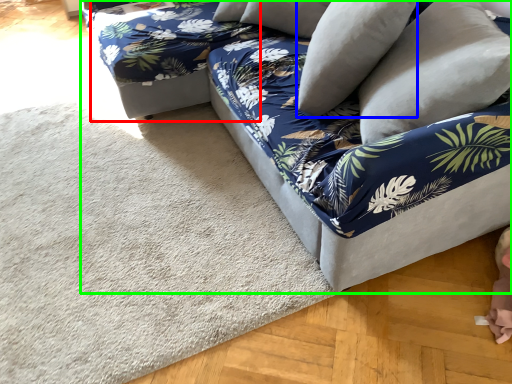
Question: Which object is positioned farthest from bean bag chair (highlighted by a red box)? Select from pillow (highlighted by a blue box) and studio couch (highlighted by a green box).

Choices:
 (A) pillow
 (B) studio couch

Answer: (A)